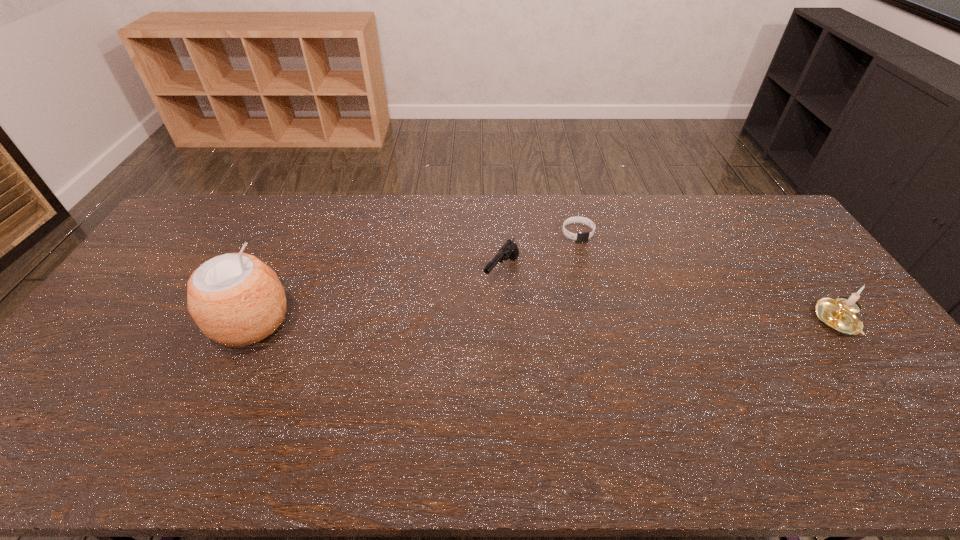
The image size is (960, 540). I want to click on vacant area at the right edge, so click(x=788, y=291).

In the image, there is a desktop. What are the coordinates of `free space at the near left corner` in the screenshot? It's located at (109, 393).

Locate an element on the screen. blank space at the far right corner of the desktop is located at coordinates (773, 224).

Where is `vacant area that lies between the rightmost object and the third object from right to left`? vacant area that lies between the rightmost object and the third object from right to left is located at coordinates (670, 297).

Find the location of a particular element. The image size is (960, 540). free space between the second object from right to left and the second tallest object is located at coordinates click(708, 277).

You are a GUI agent. You are given a task and a screenshot of the screen. Output one action in this format:
    pyautogui.click(x=<x>, y=<y>)
    Task: Click on the free space between the candle holder and the farthest object
    The height and width of the screenshot is (540, 960).
    Given the screenshot: What is the action you would take?
    pyautogui.click(x=708, y=277)

This screenshot has height=540, width=960. Find the location of `vacant space that's between the third tallest object and the wristband`. vacant space that's between the third tallest object and the wristband is located at coordinates (540, 253).

You are a GUI agent. You are given a task and a screenshot of the screen. Output one action in this format:
    pyautogui.click(x=<x>, y=<y>)
    Task: Click on the free spot between the gun and the candle holder
    The height and width of the screenshot is (540, 960).
    Given the screenshot: What is the action you would take?
    pyautogui.click(x=670, y=297)

Identify the location of free area in between the wristband and the second object from left to right. Image resolution: width=960 pixels, height=540 pixels. (540, 253).

The height and width of the screenshot is (540, 960). I want to click on blank region between the coconut and the farthest object, so click(x=415, y=278).